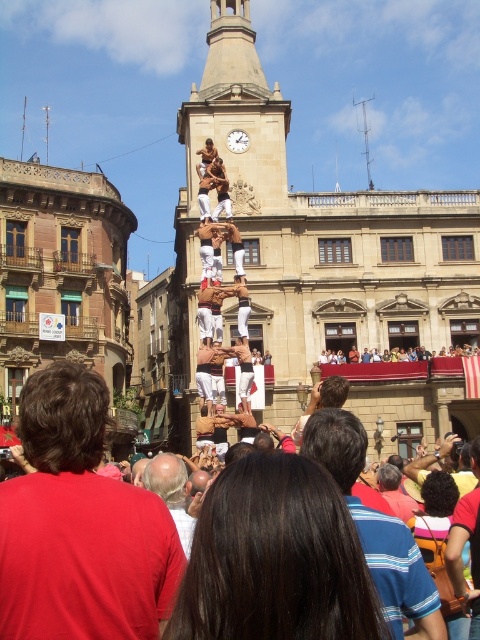
Between dark brown hair at center and bald head at center, which one appears on the right side from the viewer's perspective?

Positioned to the right is dark brown hair at center.

Which of these two, dark brown hair at center or bald head at center, stands shorter?

dark brown hair at center is shorter.

Which is in front, point (215, 612) or point (156, 460)?

Point (215, 612) is in front.

Where is `dark brown hair at center`? dark brown hair at center is located at coordinates (276, 560).

This screenshot has width=480, height=640. Describe the element at coordinates (80, 525) in the screenshot. I see `red shirt at center` at that location.

Does point (76, 560) lie behind point (233, 138)?

No, (76, 560) is in front of (233, 138).

Between point (124, 605) and point (228, 147), which one is positioned in front?

Point (124, 605)

Where is `red shirt at center`? Image resolution: width=480 pixels, height=640 pixels. red shirt at center is located at coordinates (80, 525).

Between dark brown hair at center and blue striped shirt at center, which one appears on the right side from the viewer's perspective?

From the viewer's perspective, blue striped shirt at center appears more on the right side.

Who is more forward, (257, 509) or (372, 550)?

Point (257, 509)

The width and height of the screenshot is (480, 640). I want to click on dark brown hair at center, so click(x=276, y=560).